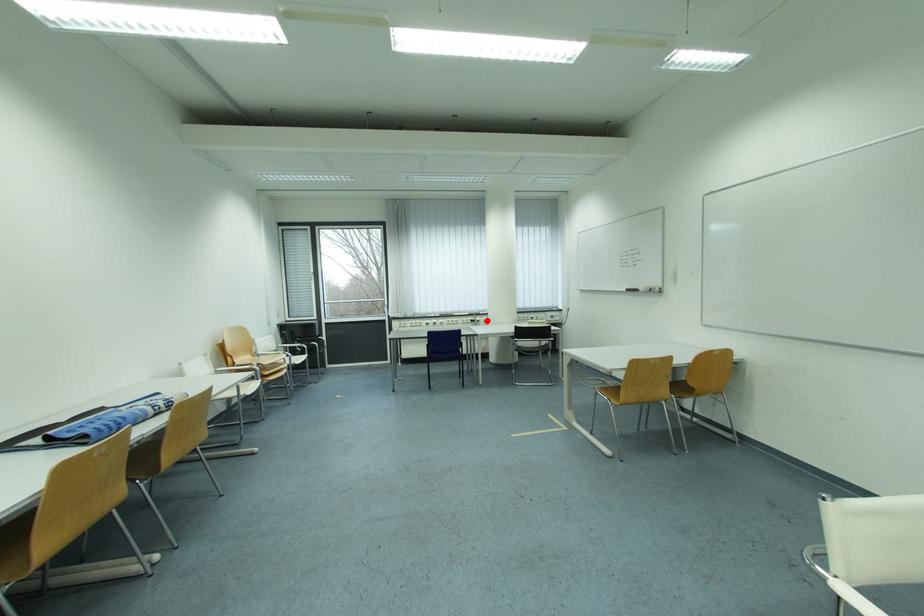
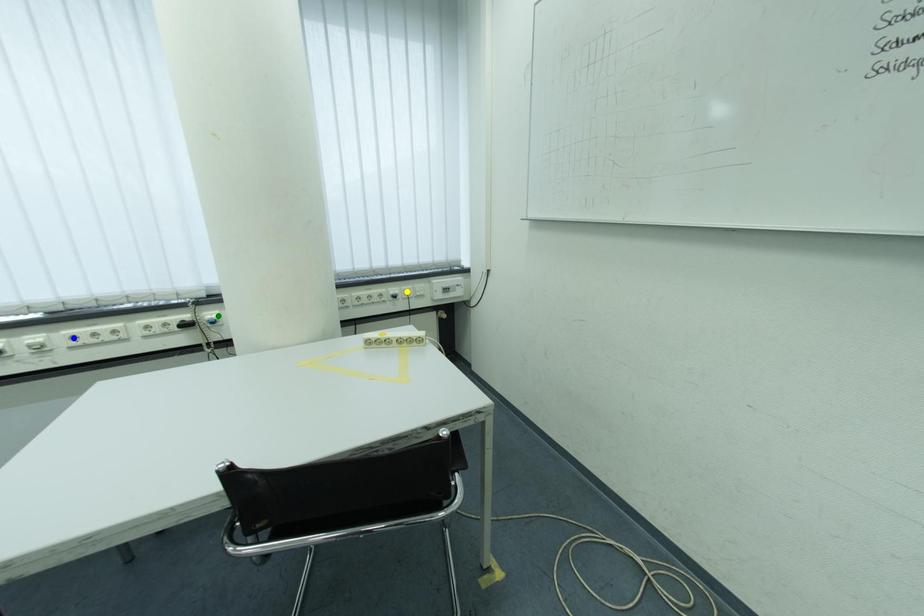
Question: I am providing you with two images of the same scene from different viewpoints. A red point is marked on the first image. You are given multiple points on the second image. In image 2, which mark is for the same physical point as the one in image 1?

Choices:
 (A) green point
 (B) yellow point
 (C) blue point

Answer: (A)